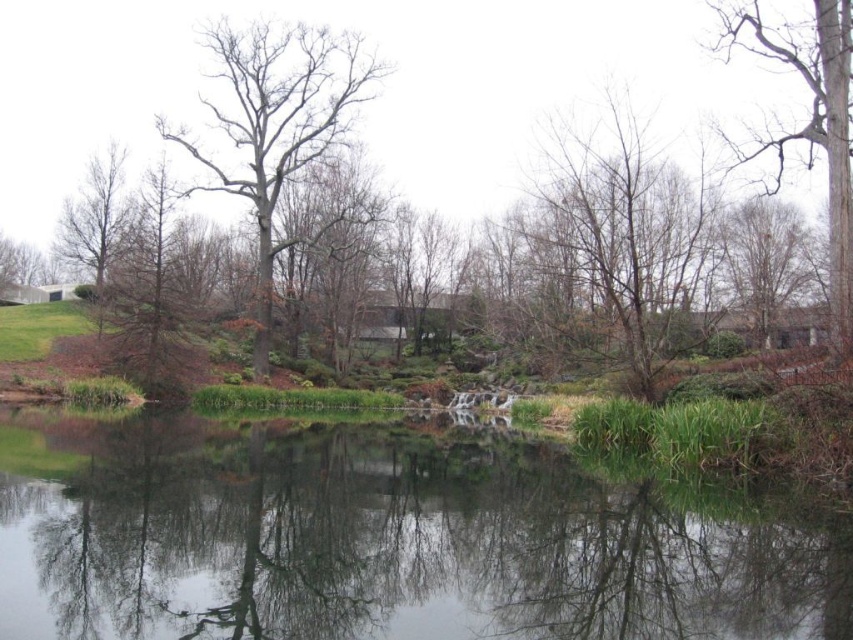
Question: Which point appears farthest from the camera in this image?

Choices:
 (A) (503, 616)
 (B) (166, 186)
 (C) (813, 28)

Answer: (B)

Question: Which object is positioned closest to the bare wood tree at left?

Choices:
 (A) bare branches at center
 (B) bare wood tree at upper right
 (C) brown matte tree at upper left
 (D) brown textured tree at upper right

Answer: (C)

Question: Does transparent water at center have a greater width compared to bare wood tree at center?

Choices:
 (A) yes
 (B) no

Answer: (A)

Question: Considering the relative positions of brown textured tree at upper right and bare wood tree at left in the image provided, where is brown textured tree at upper right located with respect to bare wood tree at left?

Choices:
 (A) right
 (B) left

Answer: (A)

Question: Which object appears closest to the camera in this image?

Choices:
 (A) bare wood tree at center
 (B) brown textured tree at upper right
 (C) transparent water at center

Answer: (C)

Question: Does bare wood tree at upper right have a greater width compared to bare wood tree at left?

Choices:
 (A) yes
 (B) no

Answer: (B)